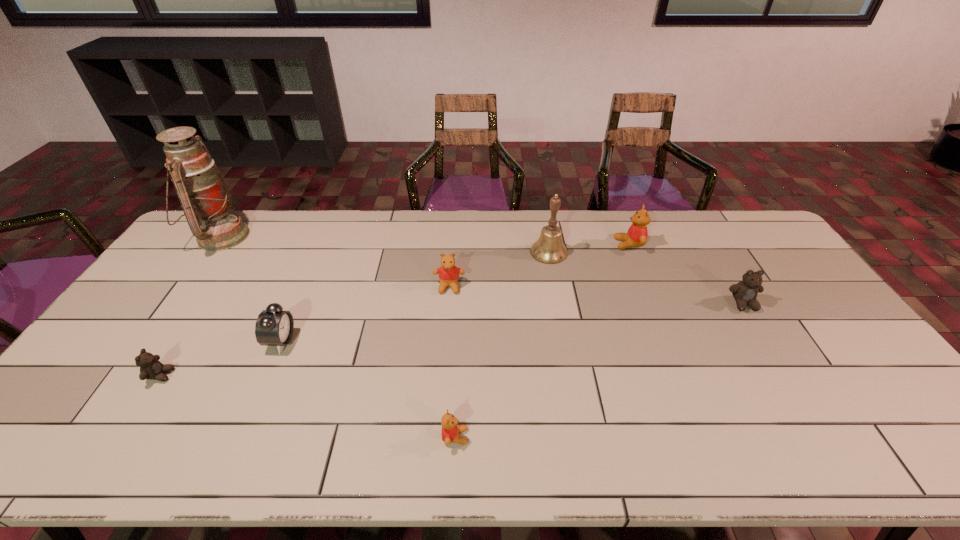
The width and height of the screenshot is (960, 540). What are the coordinates of `alarm clock` in the screenshot? It's located at (274, 327).

The width and height of the screenshot is (960, 540). Identify the location of the seventh farthest object. (151, 368).

What are the coordinates of `the smaller brown teddy bear` in the screenshot? It's located at (151, 368).

At what (x,y) coordinates should I click in order to perform the action: click on the smallest red teddy bear. Please return your answer as a coordinate pair (x, y). Looking at the image, I should click on (450, 430).

Locate an element on the screen. The height and width of the screenshot is (540, 960). the nearest object is located at coordinates (450, 430).

Image resolution: width=960 pixels, height=540 pixels. Find the location of `vacant space located 0.380m on the right of the tallest object`. vacant space located 0.380m on the right of the tallest object is located at coordinates (354, 237).

Identify the location of vacant region located 0.130m on the left of the second tallest object. (492, 252).

Locate an element on the screen. vacant area located 0.150m on the front-facing side of the seventh object from left to right is located at coordinates click(572, 244).

The height and width of the screenshot is (540, 960). I want to click on vacant space located 0.360m on the front-facing side of the seventh object from left to right, so click(x=513, y=244).

I want to click on vacant position located on the front-facing side of the seventh object from left to right, so click(549, 244).